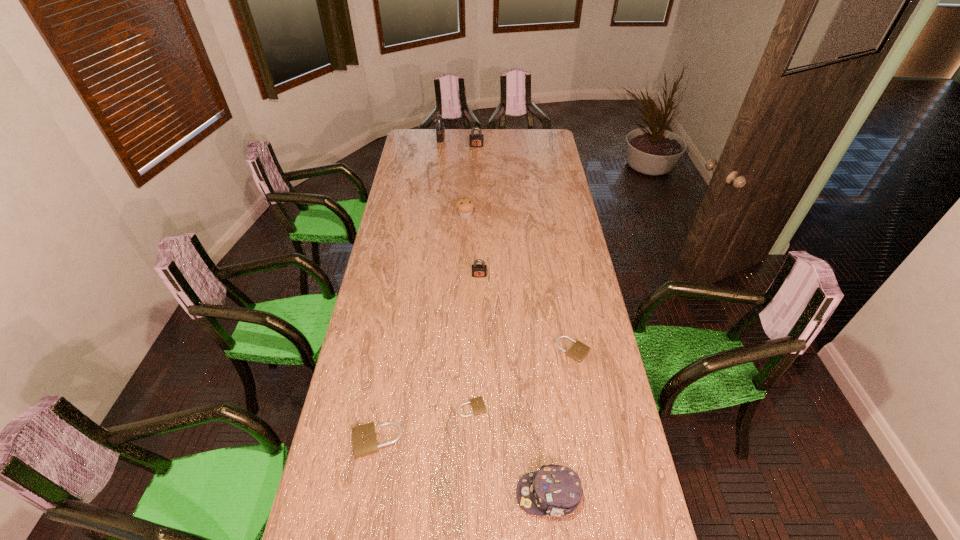
Identify which object is the seventh closest to the muffin. Please provide its 2D coordinates. Your answer should be formatted as a tuple, i.e. [(x, y)], where the tuple contains the x and y coordinates of a point satisfying the conditions above.

[(555, 490)]

Locate which padlock ranks third in proximity to the muffin. Please provide its 2D coordinates. Your answer should be formatted as a tuple, i.e. [(x, y)], where the tuple contains the x and y coordinates of a point satisfying the conditions above.

[(440, 129)]

Locate which padlock ranks fifth in proximity to the nearest padlock. Please provide its 2D coordinates. Your answer should be formatted as a tuple, i.e. [(x, y)], where the tuple contains the x and y coordinates of a point satisfying the conditions above.

[(440, 129)]

Identify which gray padlock is the closest to the sixth nearest object. Please provide its 2D coordinates. Your answer should be formatted as a tuple, i.e. [(x, y)], where the tuple contains the x and y coordinates of a point satisfying the conditions above.

[(478, 270)]

This screenshot has height=540, width=960. I want to click on gray padlock object that ranks as the second closest to the second farthest gray padlock, so click(x=478, y=270).

You are a GUI agent. You are given a task and a screenshot of the screen. Output one action in this format:
    pyautogui.click(x=<x>, y=<y>)
    Task: Click on the beige padlock that stands as the second closest to the smallest beige padlock
    
    Given the screenshot: What is the action you would take?
    pyautogui.click(x=579, y=350)

This screenshot has width=960, height=540. What are the coordinates of `beige padlock that stands as the second closest to the third farthest object` in the screenshot? It's located at (477, 404).

Locate an element on the screen. free spot that satisfies the following two spatial constraints: 1. on the back side of the second shortest padlock; 2. on the front of the tallest padlock near the keyhole is located at coordinates (535, 138).

The image size is (960, 540). Identify the location of vacant position in the image that satisfies the following two spatial constraints: 1. on the front side of the muffin; 2. on the left side of the second biggest beige padlock. (460, 350).

The image size is (960, 540). Find the location of `vacant space that satisfies the following two spatial constraints: 1. on the front of the rightmost beige padlock near the keyhole; 2. on the right side of the second tallest object`. vacant space that satisfies the following two spatial constraints: 1. on the front of the rightmost beige padlock near the keyhole; 2. on the right side of the second tallest object is located at coordinates (474, 350).